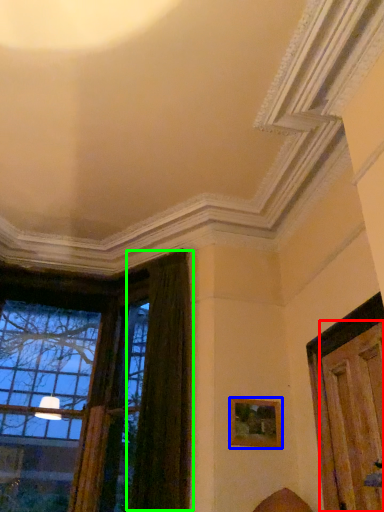
Question: Estimate the real-world distances between objects in this image. Which object is farther from door (highlighted by a red box), picture frame (highlighted by a blue box) or curtain (highlighted by a green box)?

Choices:
 (A) picture frame
 (B) curtain

Answer: (B)